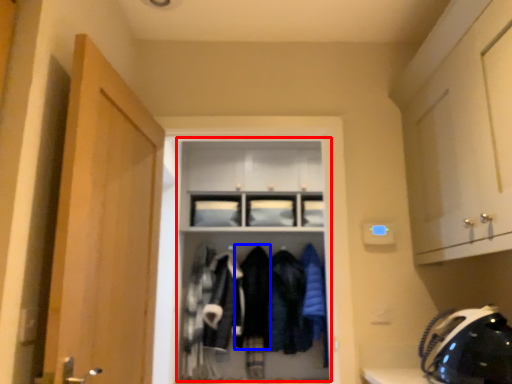
Question: Which of the following is the closest to the observer, dresser (highlighted by a red box) or clothing (highlighted by a blue box)?

Choices:
 (A) dresser
 (B) clothing

Answer: (A)